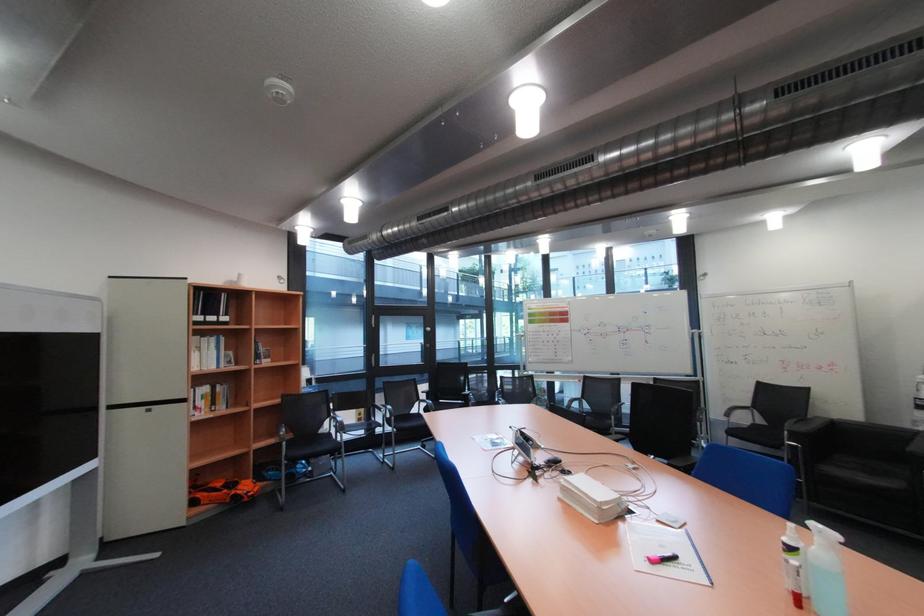
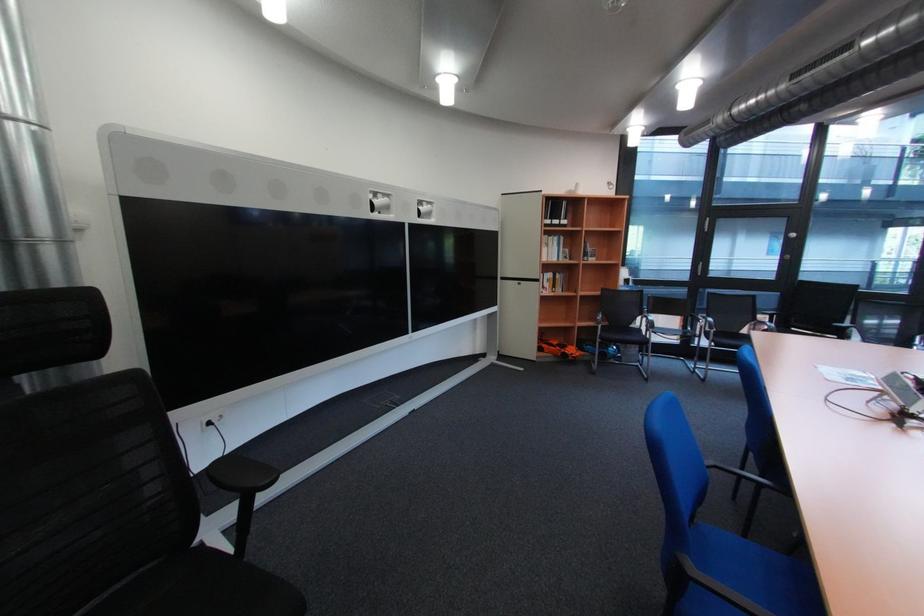
Question: The camera is either moving clockwise (left) or counter-clockwise (right) around the object. The first image is from the beginning of the video and the second image is from the end. Is the camera moving left or right when shooting the video?

Choices:
 (A) Left
 (B) Right

Answer: (B)